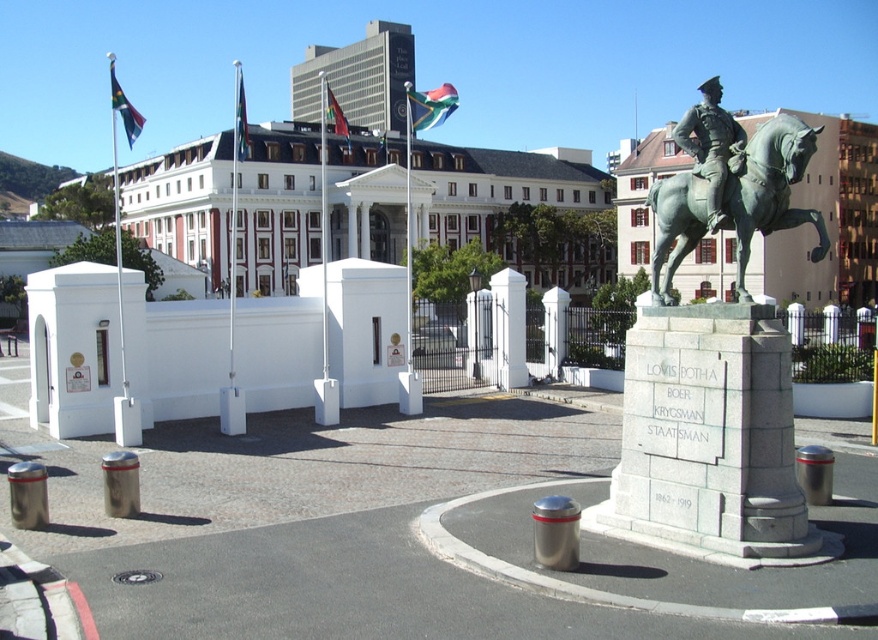
Question: Observing the image, what is the correct spatial positioning of bronze statue at center in reference to matte black flag at upper left?

Choices:
 (A) left
 (B) right

Answer: (B)

Question: Estimate the real-world distances between objects in this image. Which object is closer to the green fabric flag at upper center?

Choices:
 (A) green fabric flag at center
 (B) bronze statue at center
 (C) matte black flag at upper left
 (D) black wrought iron fence at center

Answer: (D)

Question: Among these objects, which one is farthest from the camera?

Choices:
 (A) green polished stone statue at center
 (B) matte black flag at upper left

Answer: (B)

Question: Which object is the closest to the black wrought iron fence at center?

Choices:
 (A) bronze statue at center
 (B) green patina bronze statue at center
 (C) matte black flag at upper left
 (D) polyester flag at upper center

Answer: (B)

Question: Can you confirm if matte black flag at upper left is thinner than green fabric flag at upper center?

Choices:
 (A) yes
 (B) no

Answer: (B)

Question: Does green polished stone statue at center have a lesser width compared to bronze statue at center?

Choices:
 (A) no
 (B) yes

Answer: (A)